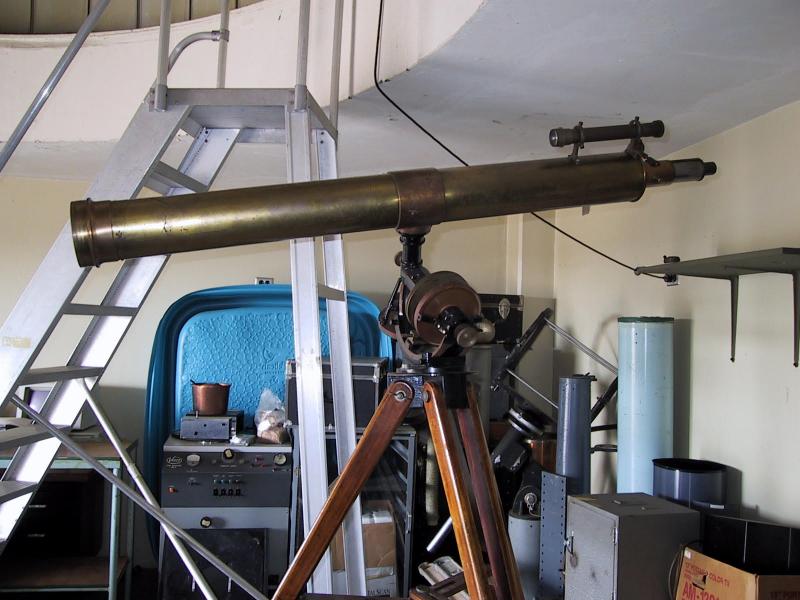
The image size is (800, 600). What are the coordinates of `right side wall` in the screenshot? It's located at (740, 201).